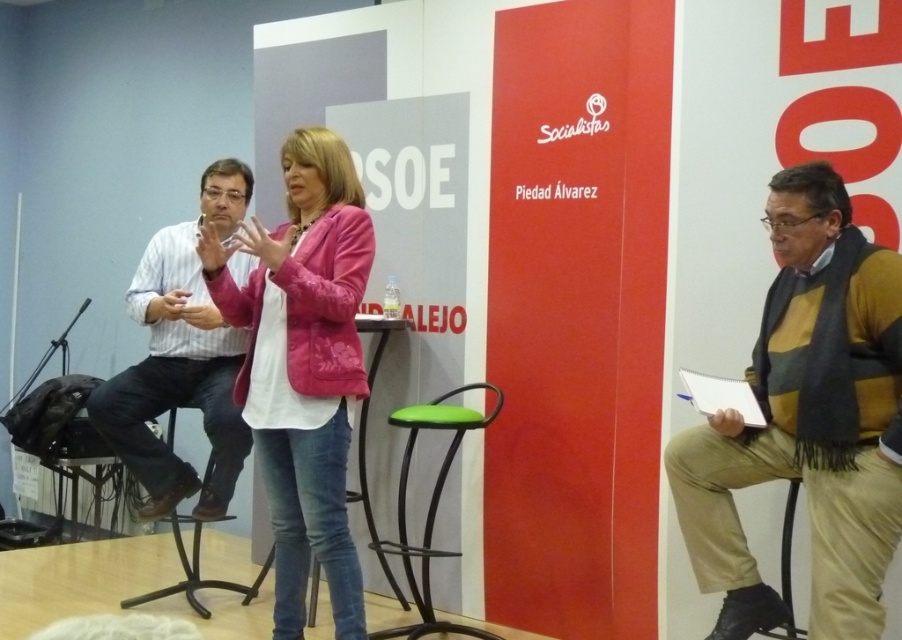
Question: Can you confirm if striped cotton shirt at left is positioned to the right of green fabric stool at center?

Choices:
 (A) yes
 (B) no

Answer: (B)

Question: Based on their relative distances, which object is nearer to the green fabric stool at center?

Choices:
 (A) metallic black stool at lower left
 (B) pink fabric jacket at center

Answer: (B)

Question: Which point is farther to the camera?

Choices:
 (A) pink fabric jacket at center
 (B) striped cotton shirt at left
 (C) striped wool sweater at right

Answer: (B)

Question: Is the position of pink fabric jacket at center less distant than that of striped cotton shirt at left?

Choices:
 (A) yes
 (B) no

Answer: (A)

Question: Where is striped wool sweater at right located in relation to green fabric stool at center in the image?

Choices:
 (A) above
 (B) below

Answer: (A)

Question: Estimate the real-world distances between objects in this image. Which object is closer to the pink fabric jacket at center?

Choices:
 (A) metallic silver chair at lower right
 (B) striped cotton shirt at left

Answer: (B)